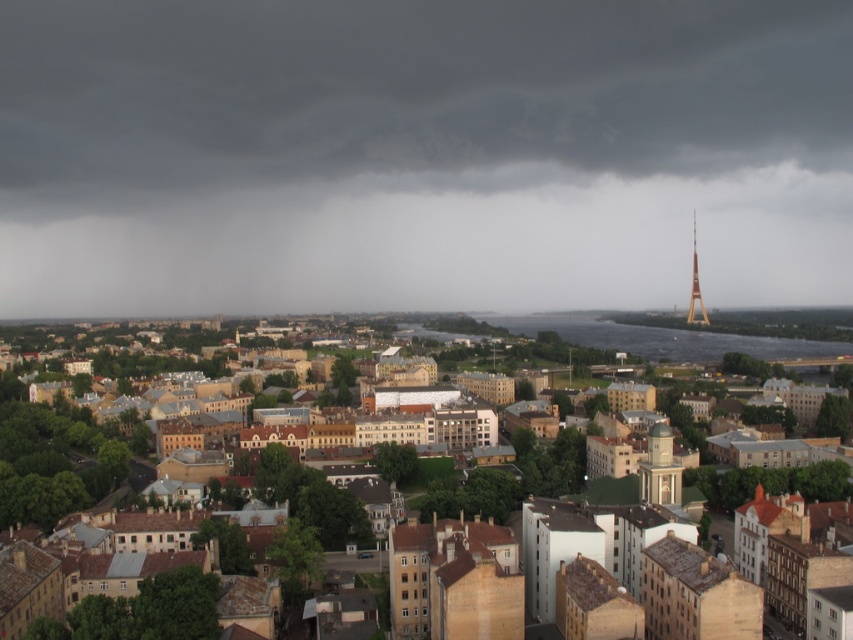
Can you confirm if dark gray cloud at upper center is shorter than yellow metallic tower at right?

No.

Image resolution: width=853 pixels, height=640 pixels. Describe the element at coordinates (421, 156) in the screenshot. I see `dark gray cloud at upper center` at that location.

Locate an element on the screen. dark gray cloud at upper center is located at coordinates (421, 156).

The image size is (853, 640). I want to click on dark gray cloud at upper center, so click(x=421, y=156).

Between point (664, 444) and point (700, 305), which one is positioned in front?

Point (664, 444) is more forward.

Which is above, white marble clock tower at center or yellow metallic tower at right?

yellow metallic tower at right is higher up.

Does point (668, 456) lie behind point (700, 314)?

That is False.

The width and height of the screenshot is (853, 640). Identify the location of white marble clock tower at center. (660, 468).

Can you confirm if brown textured buildings at center is positioned below yellow metallic tower at right?

Indeed, brown textured buildings at center is positioned under yellow metallic tower at right.

Looking at this image, can you confirm if brown textured buildings at center is shorter than yellow metallic tower at right?

Yes, brown textured buildings at center is shorter than yellow metallic tower at right.

Is point (664, 340) farther from viewer compared to point (701, 323)?

No, (664, 340) is closer to viewer.

Identify the location of brown textured buildings at center. (674, 339).